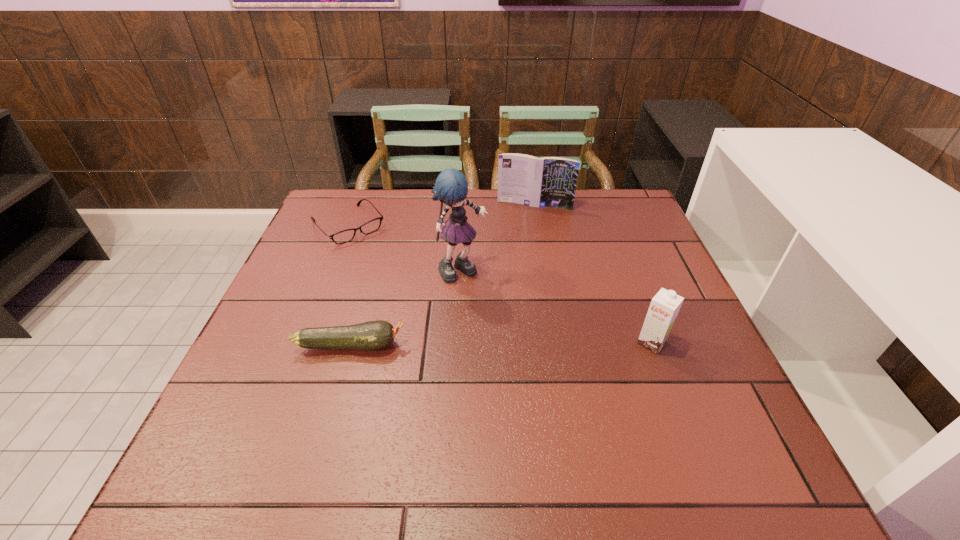
Locate an element on the screen. unoccupied area between the rag doll and the rightmost object is located at coordinates (557, 307).

Identify the location of vacant space that is in between the zucchini and the rag doll. This screenshot has height=540, width=960. (407, 308).

This screenshot has height=540, width=960. What are the coordinates of `vacant area that lies between the third farthest object and the zucchini` in the screenshot? It's located at (407, 308).

Find the location of a particular element. The height and width of the screenshot is (540, 960). vacant space in between the third nearest object and the shortest object is located at coordinates (405, 248).

Where is `vacant space that is in between the third nearest object and the rightmost object`? Image resolution: width=960 pixels, height=540 pixels. vacant space that is in between the third nearest object and the rightmost object is located at coordinates (557, 307).

Image resolution: width=960 pixels, height=540 pixels. I want to click on vacant space that is in between the rightmost object and the fourth object from left to right, so click(x=593, y=274).

Locate an element on the screen. This screenshot has width=960, height=540. vacant space that is in between the shortest object and the tallest object is located at coordinates (405, 248).

Find the location of a particular element. the second closest object to the spectacles is located at coordinates (373, 335).

Locate which object ranks second in proximity to the spectacles. Please provide its 2D coordinates. Your answer should be formatted as a tuple, i.e. [(x, y)], where the tuple contains the x and y coordinates of a point satisfying the conditions above.

[(373, 335)]

This screenshot has width=960, height=540. I want to click on blank space that satisfies the following two spatial constraints: 1. on the front side of the shortest object; 2. at the blossom end of the zucchini, so click(301, 345).